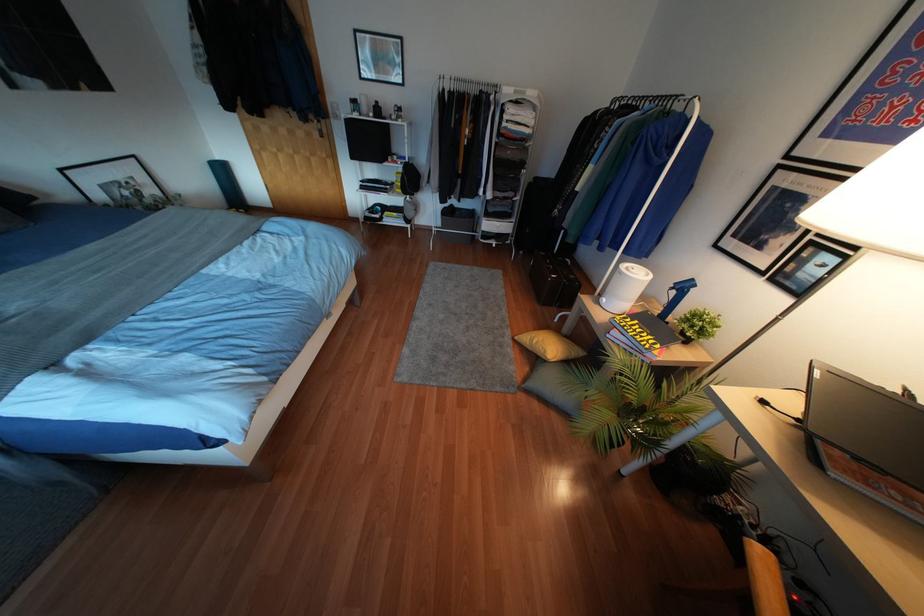
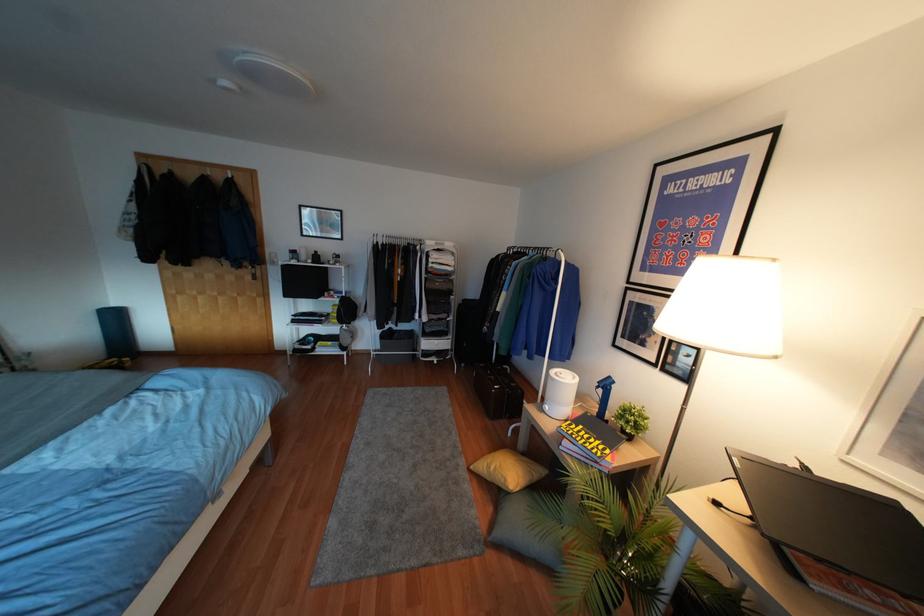
Question: Based on the continuous images, in which direction is the camera rotating? Reply with the corresponding letter.

Choices:
 (A) Left
 (B) Right
 (C) Up
 (D) Down

Answer: (C)